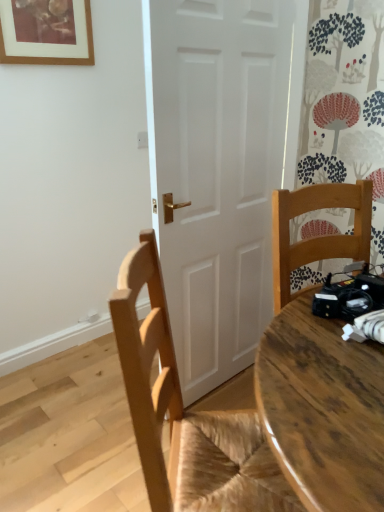
What do you see at coordinates (46, 32) in the screenshot? This screenshot has height=512, width=384. I see `matte wooden picture frame at upper left` at bounding box center [46, 32].

What is the approximate width of matte wooden picture frame at upper left?

1.55 inches.

Locate an element on the screen. Image resolution: width=384 pixels, height=512 pixels. matte wooden picture frame at upper left is located at coordinates (46, 32).

Locate an element on the screen. The image size is (384, 512). wooden chair at center is located at coordinates (186, 414).

In order to face wooden chair at center, should I rotate leftwards or rightwards?

You should rotate right by 5.083 degrees.

Describe the element at coordinates (186, 414) in the screenshot. I see `wooden chair at center` at that location.

Where is `matte wooden picture frame at upper left`? The width and height of the screenshot is (384, 512). matte wooden picture frame at upper left is located at coordinates (46, 32).

Considering the relative positions of wooden chair at center and matte wooden picture frame at upper left in the image provided, is wooden chair at center to the left of matte wooden picture frame at upper left from the viewer's perspective?

No, wooden chair at center is not to the left of matte wooden picture frame at upper left.

Is wooden chair at center closer to camera compared to matte wooden picture frame at upper left?

That is True.

Which is further, (165, 364) or (55, 7)?

Positioned behind is point (55, 7).

From the image's perspective, is wooden chair at center beneath matte wooden picture frame at upper left?

Yes, from the image's perspective, wooden chair at center is beneath matte wooden picture frame at upper left.

From a real-world perspective, which object stands above the other?

matte wooden picture frame at upper left, from a real-world perspective.

Which of these two, wooden chair at center or matte wooden picture frame at upper left, is wider?

With larger width is wooden chair at center.

Who is taller, wooden chair at center or matte wooden picture frame at upper left?

With more height is wooden chair at center.

Does wooden chair at center have a larger size compared to matte wooden picture frame at upper left?

Indeed, wooden chair at center has a larger size compared to matte wooden picture frame at upper left.

Is wooden chair at center completely or partially outside of matte wooden picture frame at upper left?

Yes, wooden chair at center is not within matte wooden picture frame at upper left.

Are wooden chair at center and matte wooden picture frame at upper left far apart?

Indeed, wooden chair at center is not near matte wooden picture frame at upper left.

Is wooden chair at center oriented away from matte wooden picture frame at upper left?

No.

How different are the orientations of wooden chair at center and matte wooden picture frame at upper left in degrees?

46.3 degrees.

The image size is (384, 512). I want to click on chair below the matte wooden picture frame at upper left (from a real-world perspective), so click(x=186, y=414).

Between matte wooden picture frame at upper left and wooden chair at center, which one appears on the right side from the viewer's perspective?

From the viewer's perspective, wooden chair at center appears more on the right side.

Is matte wooden picture frame at upper left behind wooden chair at center?

Yes, it is.

Between point (27, 22) and point (296, 509), which one is positioned in front?

The point (296, 509) is in front.

From the image's perspective, which one is positioned lower, matte wooden picture frame at upper left or wooden chair at center?

wooden chair at center, from the image's perspective.

From a real-world perspective, relative to wooden chair at center, is matte wooden picture frame at upper left vertically above or below?

matte wooden picture frame at upper left is above wooden chair at center.

Does matte wooden picture frame at upper left have a greater width compared to wooden chair at center?

No, matte wooden picture frame at upper left is not wider than wooden chair at center.

From the picture: Between matte wooden picture frame at upper left and wooden chair at center, which one has less height?

matte wooden picture frame at upper left is shorter.

Is matte wooden picture frame at upper left bigger or smaller than wooden chair at center?

matte wooden picture frame at upper left is smaller than wooden chair at center.

Would you say matte wooden picture frame at upper left is inside or outside wooden chair at center?

matte wooden picture frame at upper left cannot be found inside wooden chair at center.

Is matte wooden picture frame at upper left far away from wooden chair at center?

That's right, there is a large distance between matte wooden picture frame at upper left and wooden chair at center.

Is matte wooden picture frame at upper left turned away from wooden chair at center?

No, wooden chair at center is not at the back of matte wooden picture frame at upper left.

How distant is matte wooden picture frame at upper left from wooden chair at center?

matte wooden picture frame at upper left is 1.48 meters from wooden chair at center.

Image resolution: width=384 pixels, height=512 pixels. What are the coordinates of `chair located below the matte wooden picture frame at upper left (from the image's perspective)` in the screenshot? It's located at (186, 414).

Where is `chair below the matte wooden picture frame at upper left (from the image's perspective)`? The image size is (384, 512). chair below the matte wooden picture frame at upper left (from the image's perspective) is located at coordinates (186, 414).

This screenshot has width=384, height=512. I want to click on chair on the right of matte wooden picture frame at upper left, so click(x=186, y=414).